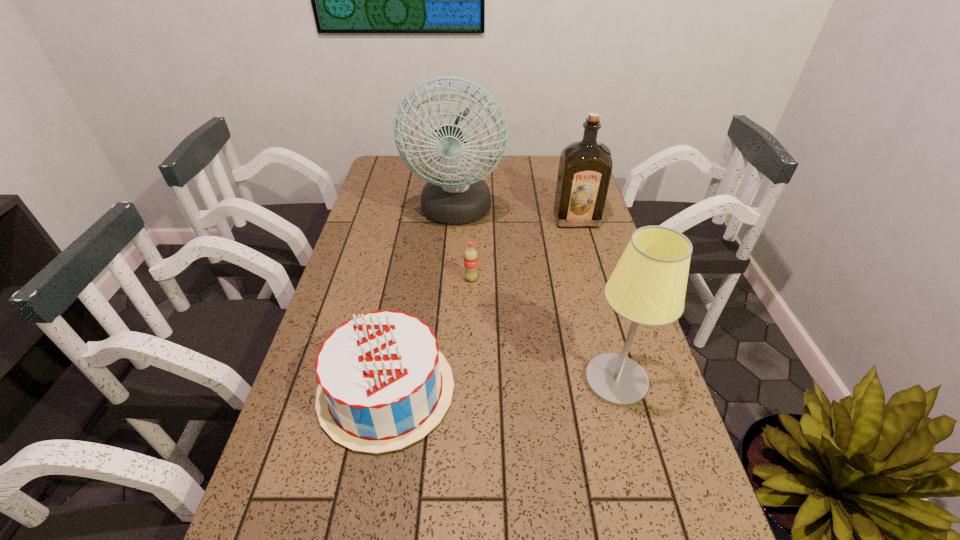
Where is `free location located on the front of the third nearest object`? The height and width of the screenshot is (540, 960). free location located on the front of the third nearest object is located at coordinates (469, 367).

Locate an element on the screen. object at the left edge is located at coordinates (383, 384).

Locate an element on the screen. The height and width of the screenshot is (540, 960). table lamp that is positioned at the right edge is located at coordinates (648, 286).

Where is `liquor that is at the right edge`? liquor that is at the right edge is located at coordinates coord(585,167).

Where is `free location at the far edge of the desktop`? This screenshot has height=540, width=960. free location at the far edge of the desktop is located at coordinates (501, 174).

Identify the location of free space at the left edge of the desktop. The image size is (960, 540). (369, 221).

The height and width of the screenshot is (540, 960). I want to click on free spot at the right edge of the desktop, so click(564, 251).

The image size is (960, 540). In the image, there is a desktop. Identify the location of vacant space at the far right corner. (553, 171).

This screenshot has height=540, width=960. I want to click on blank region between the shortest object and the liquor, so click(x=524, y=248).

At what (x,y) coordinates should I click in order to perform the action: click on free spot between the second shortest object and the fan. Please return your answer as a coordinate pair (x, y). This screenshot has width=960, height=540. Looking at the image, I should click on (421, 301).